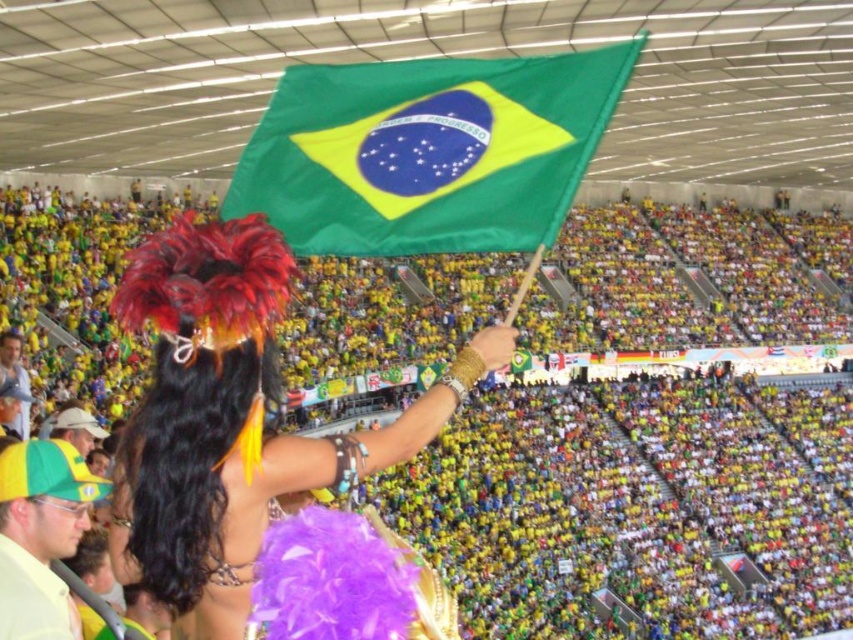
You are a photographer at the stadium and want to capture a photo of the smooth skin face at lower left without the green fabric flag at center blocking it. What should you do?

Move to the left side so that the smooth skin face at lower left is no longer behind the green fabric flag at center.

You are a photographer at the stadium and want to capture both the feathered headdress at center and the yellow fabric cap at upper left in the same frame. Can you determine which object is closer to the camera based on their positions?

The feathered headdress at center is positioned over the yellow fabric cap at upper left, so it is closer to the camera.

You are a photographer standing in the stadium and want to take a picture of the yellow fabric cap at upper left without the green fabric flag at center blocking it. What should you do?

Move to the left side so that the green fabric flag at center is no longer in front of the yellow fabric cap at upper left.